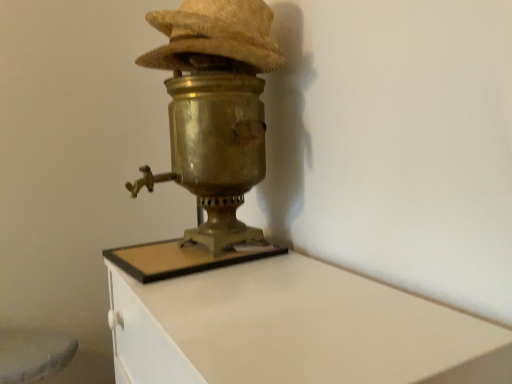
Question: From a real-world perspective, is brass/bronze table lamp at center physically located above or below brass samovar at center?

Choices:
 (A) below
 (B) above

Answer: (B)

Question: From the image's perspective, is brass/bronze table lamp at center located above or below brass samovar at center?

Choices:
 (A) below
 (B) above

Answer: (B)

Question: Which object is the closest to the brass samovar at center?

Choices:
 (A) woven straw hat at upper center
 (B) brass/bronze table lamp at center

Answer: (B)

Question: Based on their relative distances, which object is farther from the brass samovar at center?

Choices:
 (A) brass/bronze table lamp at center
 (B) woven straw hat at upper center

Answer: (B)